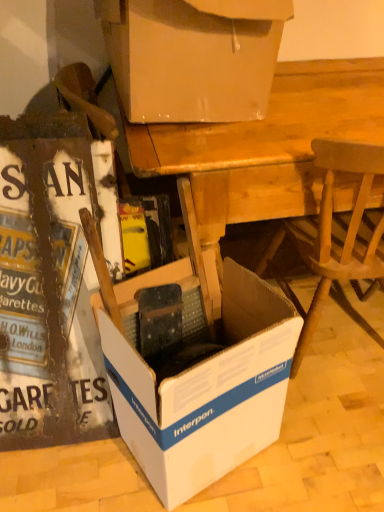
Locate an element on the screen. The height and width of the screenshot is (512, 384). blank space situated above wooden desk at center (from a real-world perspective) is located at coordinates (314, 92).